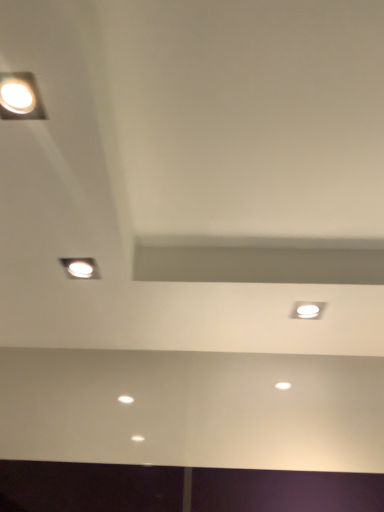
Question: Considering the relative sizes of white glossy light fixture at upper right and matte silver lamp at upper left, which is the 2th lamp in front-to-back order, in the image provided, is white glossy light fixture at upper right smaller than matte silver lamp at upper left, which is the 2th lamp in front-to-back order,?

Choices:
 (A) no
 (B) yes

Answer: (B)

Question: From the image's perspective, does white glossy light fixture at upper right appear higher than matte silver lamp at upper left, which is the 2th lamp in front-to-back order?

Choices:
 (A) yes
 (B) no

Answer: (B)

Question: Is white glossy light fixture at upper right further to camera compared to matte silver lamp at upper left, placed as the 1th lamp when sorted from back to front?

Choices:
 (A) yes
 (B) no

Answer: (A)

Question: From the image's perspective, is white glossy light fixture at upper right below matte silver lamp at upper left, placed as the 1th lamp when sorted from back to front?

Choices:
 (A) no
 (B) yes

Answer: (B)

Question: Is white glossy light fixture at upper right next to matte silver lamp at upper left, placed as the 1th lamp when sorted from back to front?

Choices:
 (A) yes
 (B) no

Answer: (B)

Question: Is white glossy light fixture at upper right to the left of matte silver lamp at upper left, which is counted as the second lamp, starting from the top, from the viewer's perspective?

Choices:
 (A) yes
 (B) no

Answer: (B)

Question: From the image's perspective, is matte white light fixture at upper left, the second lamp in the bottom-to-top sequence, on top of matte silver lamp at upper left, which is counted as the second lamp, starting from the top?

Choices:
 (A) no
 (B) yes

Answer: (B)

Question: Does matte white light fixture at upper left, which is the 1th lamp from top to bottom, have a greater height compared to matte silver lamp at upper left, which is counted as the second lamp, starting from the top?

Choices:
 (A) yes
 (B) no

Answer: (B)

Question: Is the depth of matte white light fixture at upper left, the 1th lamp in the front-to-back sequence, less than that of matte silver lamp at upper left, which is the 2th lamp in front-to-back order?

Choices:
 (A) yes
 (B) no

Answer: (A)

Question: Is matte white light fixture at upper left, which is the 1th lamp from top to bottom, smaller than matte silver lamp at upper left, which is counted as the second lamp, starting from the top?

Choices:
 (A) no
 (B) yes

Answer: (B)

Question: Considering the relative sizes of matte white light fixture at upper left, the 1th lamp in the front-to-back sequence, and matte silver lamp at upper left, which ranks as the first lamp in bottom-to-top order, in the image provided, is matte white light fixture at upper left, the 1th lamp in the front-to-back sequence, thinner than matte silver lamp at upper left, which ranks as the first lamp in bottom-to-top order,?

Choices:
 (A) no
 (B) yes

Answer: (A)

Question: Could you tell me if matte white light fixture at upper left, acting as the second lamp starting from the back, is facing matte silver lamp at upper left, which is the 2th lamp in front-to-back order?

Choices:
 (A) no
 (B) yes

Answer: (A)

Question: Is matte white light fixture at upper left, the 1th lamp in the front-to-back sequence, taller than white glossy light fixture at upper right?

Choices:
 (A) yes
 (B) no

Answer: (A)